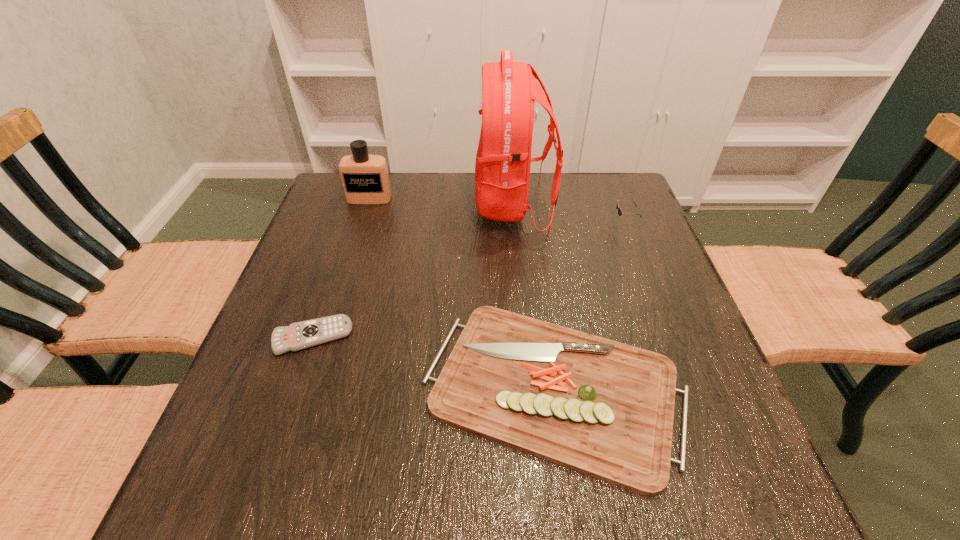
Identify the location of vacant space located 0.280m in front of the lenses of the sunglasses. The image size is (960, 540). (507, 223).

In order to click on vacant space situated in front of the lenses of the sunglasses in this screenshot , I will do (x=575, y=223).

This screenshot has width=960, height=540. In order to click on blank space located on the back of the second shortest object in this screenshot , I will do `click(535, 249)`.

The width and height of the screenshot is (960, 540). I want to click on vacant space situated 0.260m on the back of the shortest object, so click(346, 240).

Locate an element on the screen. The width and height of the screenshot is (960, 540). backpack positioned at the far edge is located at coordinates (509, 89).

At what (x,y) coordinates should I click in order to perform the action: click on perfume at the far edge. Please return your answer as a coordinate pair (x, y). Image resolution: width=960 pixels, height=540 pixels. Looking at the image, I should click on (365, 180).

The height and width of the screenshot is (540, 960). What are the coordinates of `sunglasses positioned at the far edge` in the screenshot? It's located at (620, 212).

At what (x,y) coordinates should I click in order to perform the action: click on object that is at the near edge. Please return your answer as a coordinate pair (x, y). Image resolution: width=960 pixels, height=540 pixels. Looking at the image, I should click on (600, 407).

Locate an element on the screen. This screenshot has width=960, height=540. perfume present at the left edge is located at coordinates pos(365,180).

I want to click on remote control that is at the left edge, so click(297, 336).